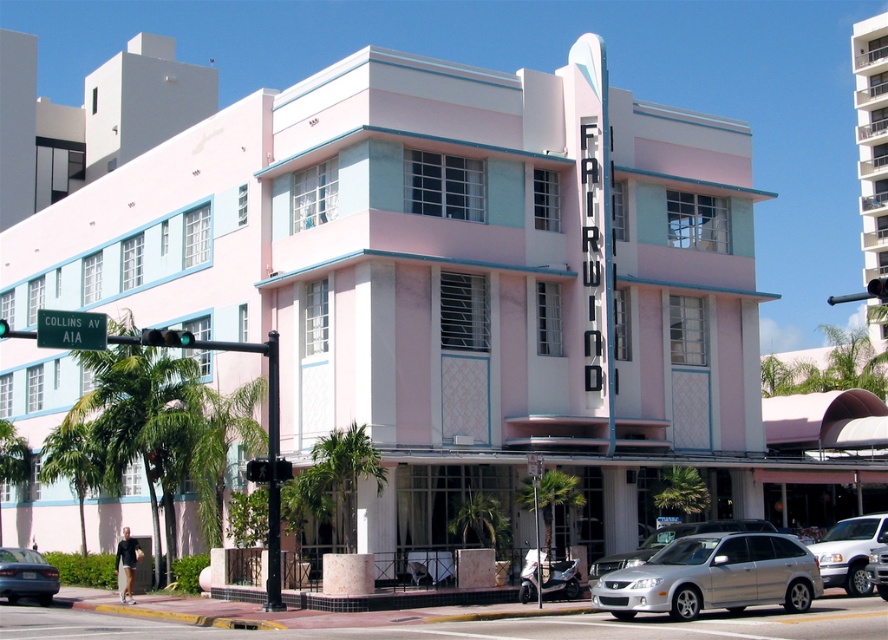
Question: Considering the relative positions of green glass traffic light at lower left and green glass traffic light at upper center in the image provided, where is green glass traffic light at lower left located with respect to green glass traffic light at upper center?

Choices:
 (A) right
 (B) left

Answer: (B)

Question: Which point is closer to the camera?

Choices:
 (A) silver metallic sedan at lower right
 (B) silver metallic hatchback at lower center
 (C) green leafy palm tree at left

Answer: (B)

Question: From the image, what is the correct spatial relationship of green leafy palm tree at center in relation to silver metallic sedan at lower right?

Choices:
 (A) below
 (B) above

Answer: (B)

Question: Which is farther from the silver metallic sedan at lower right?

Choices:
 (A) silver metallic scooter at lower center
 (B) silver metallic hatchback at lower center
 (C) green leafy palm tree at lower left
 (D) white concrete building at upper right

Answer: (D)

Question: Which point is farther from the camera taking this photo?

Choices:
 (A) (324, 483)
 (B) (568, 561)
 (C) (4, 324)

Answer: (A)

Question: Is the position of silver metallic sedan at lower right more distant than that of green metal street sign at upper left?

Choices:
 (A) yes
 (B) no

Answer: (A)